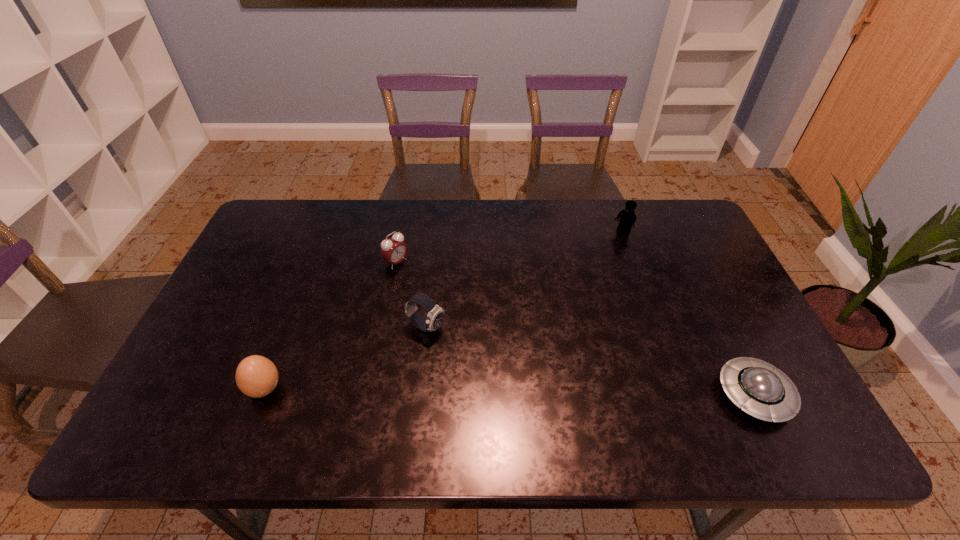
In the image, there is a desktop. Where is `free region at the far right corner`? The height and width of the screenshot is (540, 960). free region at the far right corner is located at coordinates (656, 207).

Find the location of a particular element. This screenshot has height=540, width=960. free space between the fourth object from right to left and the shortest object is located at coordinates (575, 328).

Identify the location of free spot between the fourth object from right to left and the leftmost object. The width and height of the screenshot is (960, 540). (330, 326).

Locate an element on the screen. blank region between the Lego and the saucer is located at coordinates (688, 313).

I want to click on vacant area between the Lego and the alarm clock, so click(x=509, y=247).

Where is `blank region between the second farthest object and the saucer`? blank region between the second farthest object and the saucer is located at coordinates (575, 328).

The image size is (960, 540). What are the coordinates of `vacant space that is in between the second object from left to right and the leftmost object` in the screenshot? It's located at (330, 326).

Where is `free space between the alarm clock and the rightmost object`? The width and height of the screenshot is (960, 540). free space between the alarm clock and the rightmost object is located at coordinates (575, 328).

At what (x,y) coordinates should I click in order to perform the action: click on unoccupied position between the leftmost object and the third nearest object. Please return your answer as a coordinate pair (x, y). Image resolution: width=960 pixels, height=540 pixels. Looking at the image, I should click on (346, 359).

The width and height of the screenshot is (960, 540). I want to click on free space that is in between the fourth object from right to left and the watch, so click(x=411, y=295).